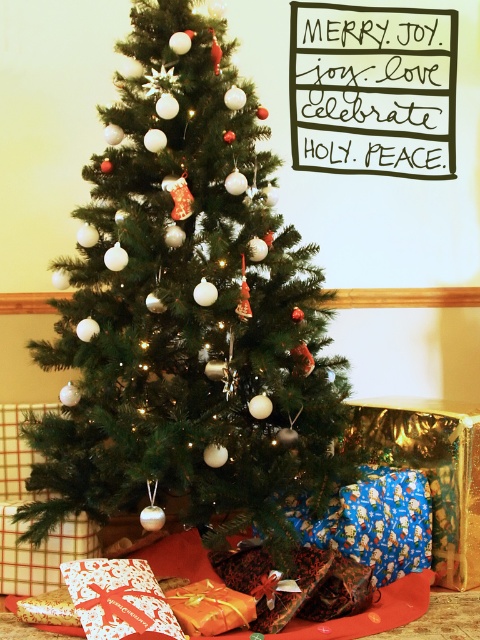
Is green matte christmas tree at center to the left of white glossy gift at lower center from the viewer's perspective?

In fact, green matte christmas tree at center is to the right of white glossy gift at lower center.

Is green matte christmas tree at center smaller than white glossy gift at lower center?

Incorrect, green matte christmas tree at center is not smaller in size than white glossy gift at lower center.

Which is behind, point (126, 195) or point (131, 588)?

The point (126, 195) is more distant.

Image resolution: width=480 pixels, height=640 pixels. I want to click on green matte christmas tree at center, so click(189, 310).

Who is positioned more to the left, white glossy gift at lower center or shiny gold wrapping paper at lower center?

From the viewer's perspective, white glossy gift at lower center appears more on the left side.

Does point (162, 621) come in front of point (210, 604)?

Yes, point (162, 621) is in front of point (210, 604).

Which is behind, point (144, 616) or point (206, 595)?

The point (206, 595) is behind.

I want to click on white glossy gift at lower center, so click(120, 600).

This screenshot has height=640, width=480. I want to click on green matte christmas tree at center, so click(189, 310).

Is green matte christmas tree at center to the left of shiny gold wrapping paper at lower center from the viewer's perspective?

Correct, you'll find green matte christmas tree at center to the left of shiny gold wrapping paper at lower center.

Find the location of `green matte christmas tree at center`. green matte christmas tree at center is located at coordinates (189, 310).